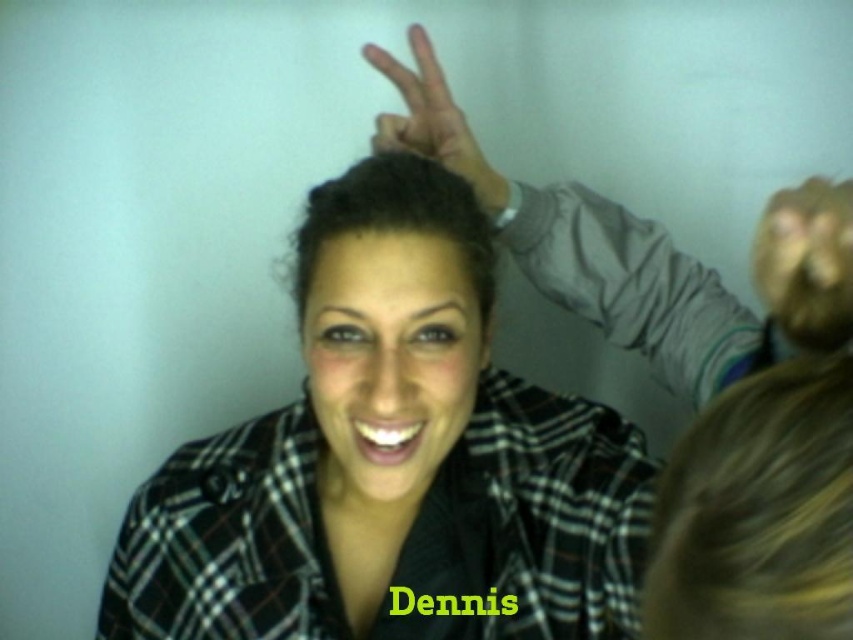
Question: Considering the real-world distances, which object is closest to the matte gray hand at upper center?

Choices:
 (A) matte skin hand at upper center
 (B) matte black face at center
 (C) dark brown shiny hair at center
 (D) plaid shirt at center

Answer: (A)

Question: From the image, what is the correct spatial relationship of blonde hair at lower right in relation to dark brown shiny hair at center?

Choices:
 (A) left
 (B) right

Answer: (B)

Question: Is plaid shirt at center above matte black face at center?

Choices:
 (A) no
 (B) yes

Answer: (A)

Question: Among these points, which one is farthest from the camera?

Choices:
 (A) (457, 278)
 (B) (798, 611)

Answer: (A)

Question: Which of the following is the closest to the observer?

Choices:
 (A) matte gray hand at upper center
 (B) dark brown shiny hair at center
 (C) matte black face at center
 (D) blonde hair at lower right

Answer: (D)

Question: Does dark brown shiny hair at center appear under matte skin hand at upper center?

Choices:
 (A) no
 (B) yes

Answer: (B)